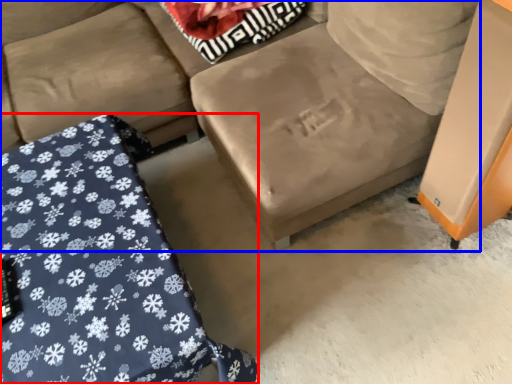
Question: Which object is further to the camera taking this photo, furniture (highlighted by a red box) or studio couch (highlighted by a blue box)?

Choices:
 (A) furniture
 (B) studio couch

Answer: (B)